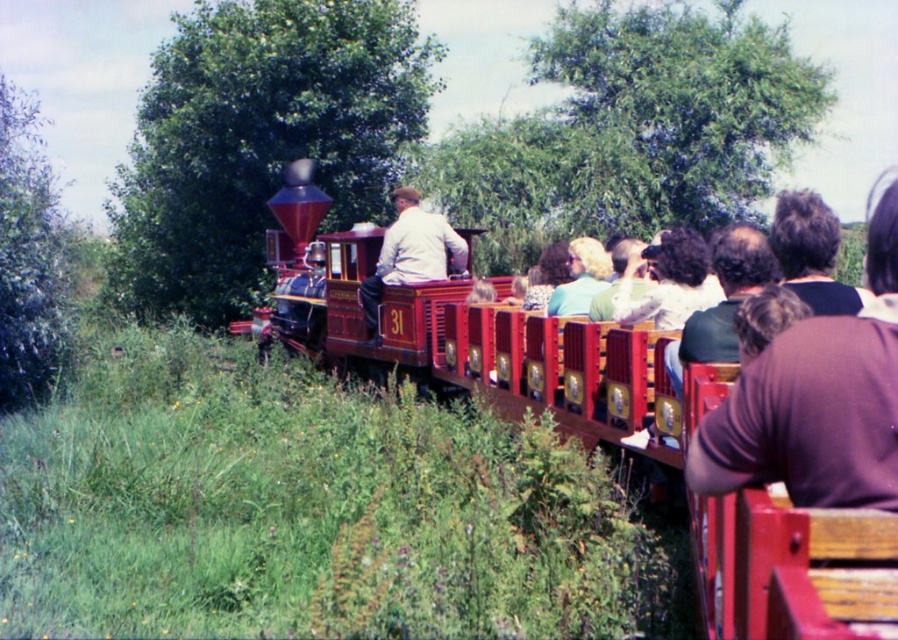
Question: Among these points, which one is nearest to the camera?

Choices:
 (A) (597, 282)
 (B) (776, 458)
 (C) (514, 404)
 (D) (454, 248)

Answer: (B)

Question: In this image, where is polished wood train at center located relative to dark brown hair at upper right?

Choices:
 (A) above
 (B) below

Answer: (B)

Question: Can you confirm if polished wood train at center is smaller than brown fabric shirt at right?

Choices:
 (A) no
 (B) yes

Answer: (A)

Question: Which point is farther from the camera taking this photo?

Choices:
 (A) (485, 332)
 (B) (867, 500)
 (C) (788, 228)

Answer: (A)

Question: Can you confirm if brown fabric shirt at right is bigger than dark brown hair at upper right?

Choices:
 (A) yes
 (B) no

Answer: (B)

Question: Among these objects, which one is nearest to the camera?

Choices:
 (A) polished wood train at center
 (B) matte white shirt at center

Answer: (A)